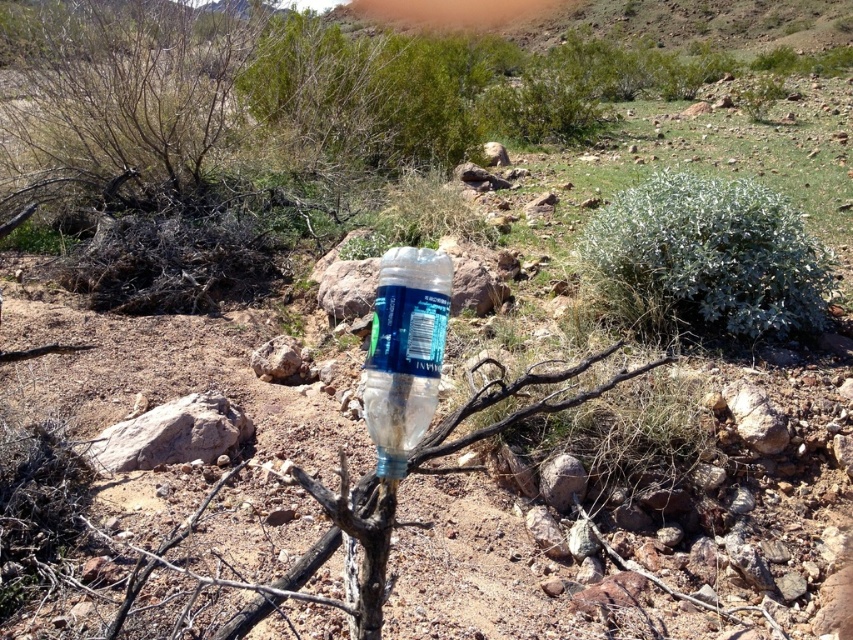
Question: Which object appears closest to the camera in this image?

Choices:
 (A) transparent plastic bottle at center
 (B) green fuzzy bush at center right

Answer: (A)

Question: Which object appears closest to the camera in this image?

Choices:
 (A) green fuzzy bush at center right
 (B) transparent plastic bottle at center
 (C) clear plastic branch at center

Answer: (B)

Question: Does transparent plastic bottle at center have a smaller size compared to clear plastic branch at center?

Choices:
 (A) yes
 (B) no

Answer: (A)

Question: Which point appears closest to the camera in this image?

Choices:
 (A) (645, 236)
 (B) (428, 358)
 (C) (444, 445)

Answer: (B)

Question: Is green fuzzy bush at center right bigger than transparent plastic bottle at center?

Choices:
 (A) no
 (B) yes

Answer: (B)

Question: Is green fuzzy bush at center right thinner than clear plastic branch at center?

Choices:
 (A) no
 (B) yes

Answer: (A)